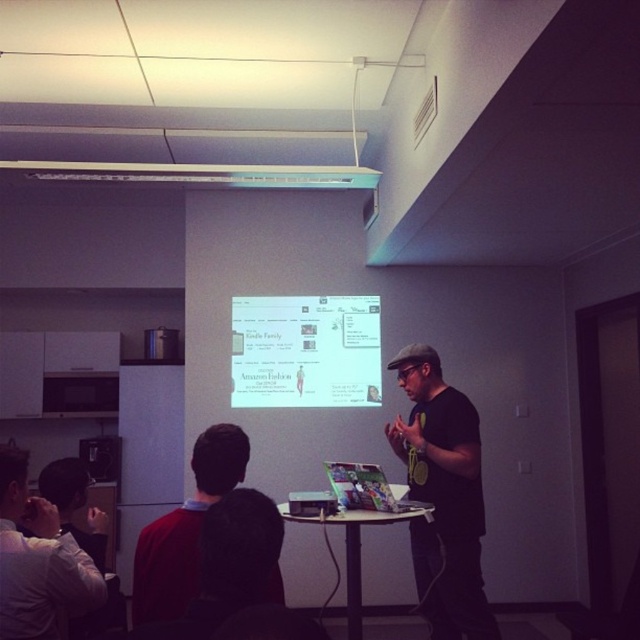
Which is below, white glossy projection screen at center or matte black shirt at lower left?

matte black shirt at lower left is below.

Which is more to the right, white glossy projection screen at center or matte black shirt at lower left?

white glossy projection screen at center is more to the right.

The image size is (640, 640). I want to click on white glossy projection screen at center, so click(305, 352).

Which is more to the right, matte black shirt at lower left or dark brown hair at center?

From the viewer's perspective, dark brown hair at center appears more on the right side.

This screenshot has height=640, width=640. What do you see at coordinates (38, 561) in the screenshot?
I see `matte black shirt at lower left` at bounding box center [38, 561].

This screenshot has height=640, width=640. I want to click on matte black shirt at lower left, so click(38, 561).

Between black matte shirt at center and white glossy projection screen at center, which one has more height?

black matte shirt at center

This screenshot has height=640, width=640. What are the coordinates of `black matte shirt at center` in the screenshot? It's located at (442, 496).

Where is `black matte shirt at center`? This screenshot has height=640, width=640. black matte shirt at center is located at coordinates (442, 496).

This screenshot has width=640, height=640. I want to click on black matte shirt at center, so [442, 496].